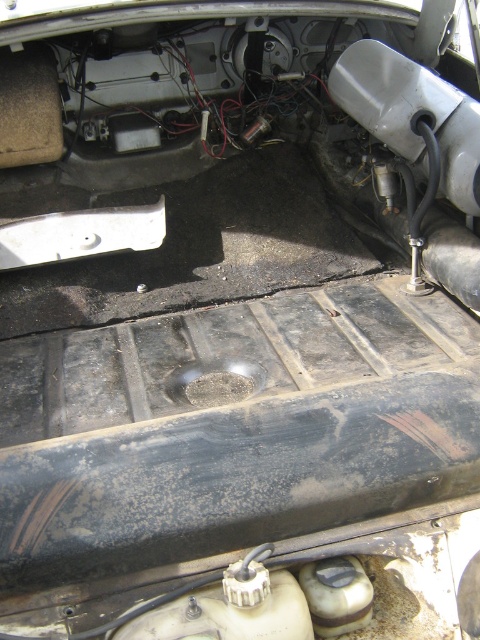
Is matte plastic bumper at upper center to the left of white matte bumper at center from the viewer's perspective?

No, matte plastic bumper at upper center is not to the left of white matte bumper at center.

Can you confirm if matte plastic bumper at upper center is positioned to the right of white matte bumper at center?

Indeed, matte plastic bumper at upper center is positioned on the right side of white matte bumper at center.

In order to click on matte plastic bumper at upper center in this screenshot , I will do `click(411, 115)`.